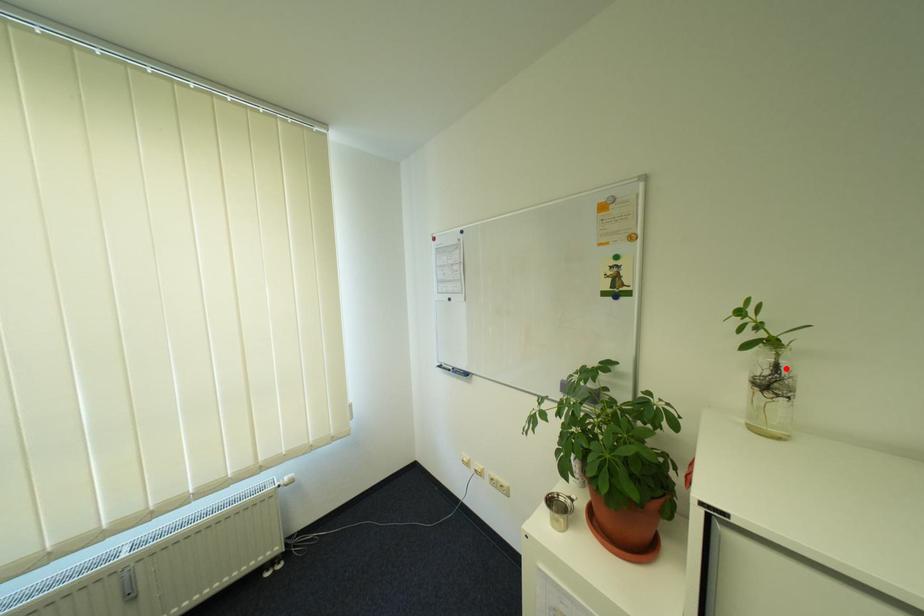
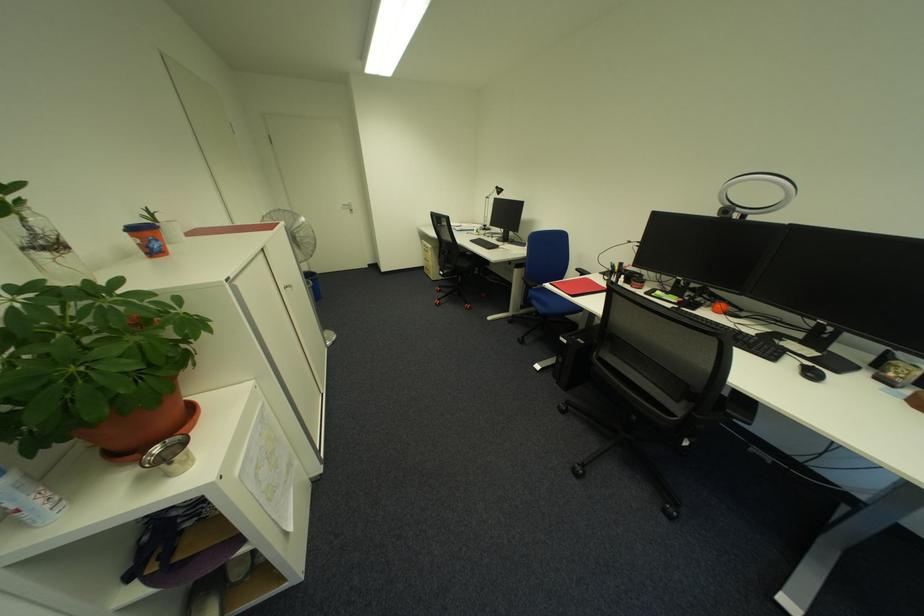
Find the pixel in the second image that matches the highlighted location in the first image.

(40, 230)